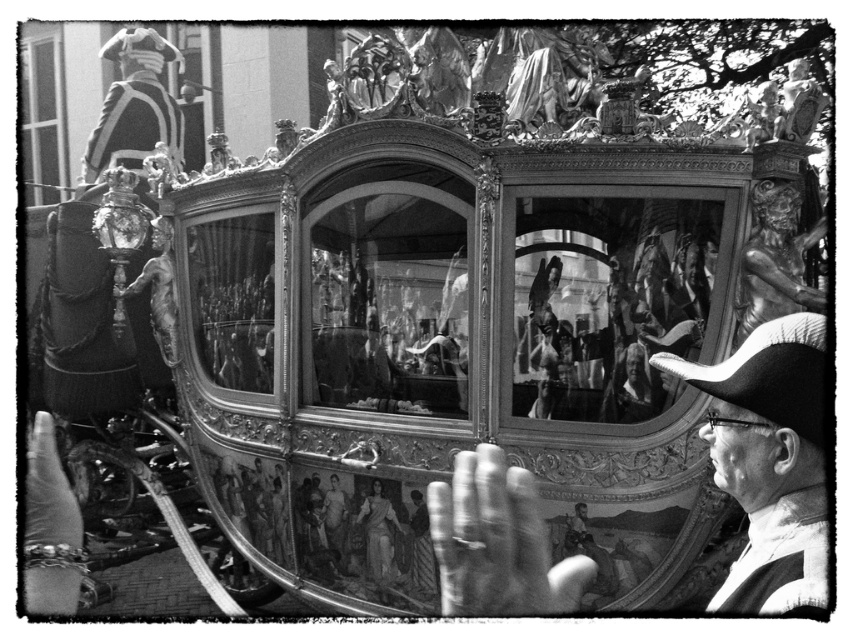
You are a photographer trying to capture the smooth black hat at right and the smooth white statue at center in the same frame. Based on their heights, which object should you focus on first to ensure both are in the shot?

The smooth black hat at right is taller than the smooth white statue at center, so you should focus on the smooth black hat at right first to ensure both are in the shot.

Based on the photo, what is the color of the object located at point (769, 460) in the image?

The object at point (769, 460) is a smooth black hat at right.

You are standing at the base of the carriage and want to place a smooth leather hat at center on top of one of the statues. The statues are 79.55 feet away from you. Can you reach them with a 100 foot long pole?

The statues are 79.55 feet away from you, so yes, you can reach them with a 100 foot long pole since it is longer than the distance required.